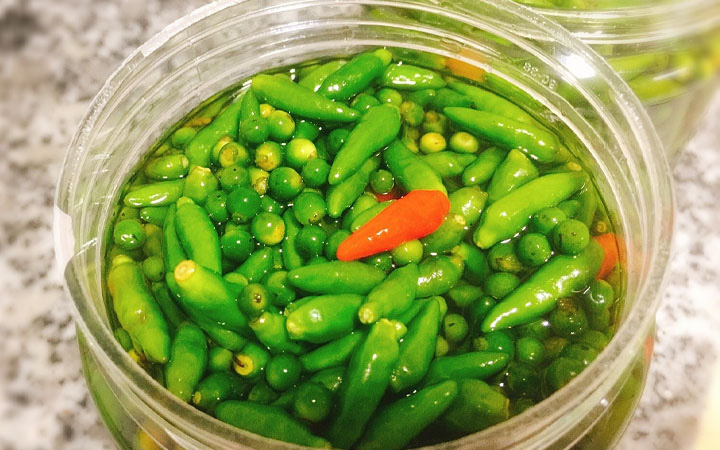
Locate an element on the screen. countertops is located at coordinates (677, 329).